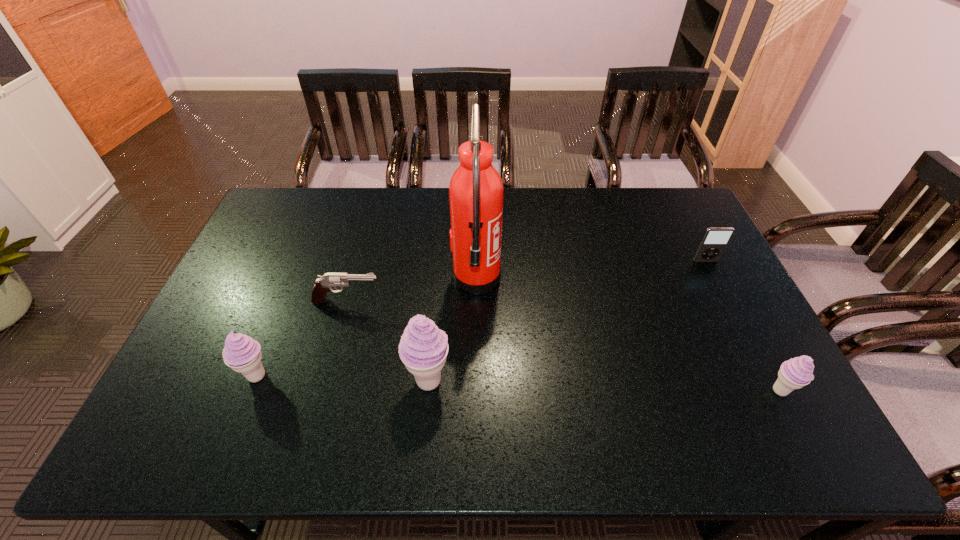
You are a GUI agent. You are given a task and a screenshot of the screen. Output one action in this format:
    pyautogui.click(x=<x>, y=<y>)
    Task: Click on the free spot between the rightmost icecream and the leftmost icecream
    The width and height of the screenshot is (960, 540).
    Given the screenshot: What is the action you would take?
    pyautogui.click(x=518, y=383)

Locate an element on the screen. The image size is (960, 540). unoccupied area between the tallest icecream and the rightmost icecream is located at coordinates pos(604,386).

I want to click on free space between the iPod and the tallest object, so click(x=590, y=270).

At what (x,y) coordinates should I click in order to perform the action: click on empty space that is in between the rightmost icecream and the tallest icecream. Please return your answer as a coordinate pair (x, y). This screenshot has height=540, width=960. Looking at the image, I should click on (604, 386).

Identify the location of object that is the fourth closest to the second icecream from left to right. (795, 373).

This screenshot has height=540, width=960. What are the coordinates of `object that stands as the second closest to the iPod` in the screenshot? It's located at (476, 191).

You are a GUI agent. You are given a task and a screenshot of the screen. Output one action in this format:
    pyautogui.click(x=<x>, y=<y>)
    Task: Click on the closest icecream to the fourth shortest object
    
    Given the screenshot: What is the action you would take?
    pyautogui.click(x=423, y=348)

Identify the location of icecream that is the nearest to the fifth object from right to left. [x=241, y=353].

The width and height of the screenshot is (960, 540). Identify the location of vacant space that satisfies the following two spatial constraints: 1. on the front side of the fourth shortest object; 2. on the left side of the second icecream from right to left. (255, 381).

Identify the location of blank space that satisfies the following two spatial constraints: 1. on the label side of the tallest object; 2. on the back side of the rightmost icecream. The height and width of the screenshot is (540, 960). (475, 390).